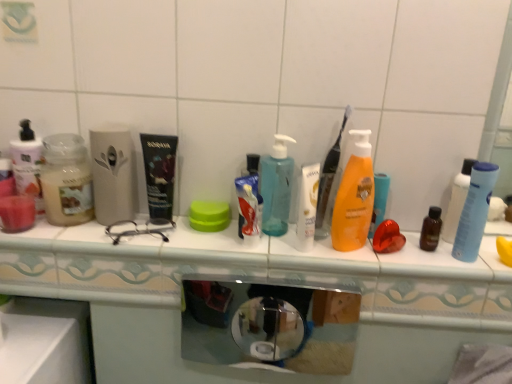
Question: From a real-world perspective, is translucent plastic pump bottle at center, which appears as the 2th bottle when viewed from the right, positioned under green plastic lid at center based on gravity?

Choices:
 (A) yes
 (B) no

Answer: (B)

Question: Are translucent plastic pump bottle at center, the 2th bottle viewed from the left, and green plastic lid at center beside each other?

Choices:
 (A) yes
 (B) no

Answer: (B)

Question: Does translucent plastic pump bottle at center, which appears as the 2th bottle when viewed from the right, have a lesser height compared to green plastic lid at center?

Choices:
 (A) no
 (B) yes

Answer: (A)

Question: Is translucent plastic pump bottle at center, the 2th bottle viewed from the left, turned away from green plastic lid at center?

Choices:
 (A) yes
 (B) no

Answer: (B)

Question: Are translucent plastic pump bottle at center, which appears as the 2th bottle when viewed from the right, and green plastic lid at center located far from each other?

Choices:
 (A) no
 (B) yes

Answer: (A)

Question: Considering the positions of white glossy toothpaste at center and orange matte lotion at center, marked as the third bottle in a left-to-right arrangement, in the image, is white glossy toothpaste at center bigger or smaller than orange matte lotion at center, marked as the third bottle in a left-to-right arrangement,?

Choices:
 (A) big
 (B) small

Answer: (B)

Question: From their relative heights in the image, would you say white glossy toothpaste at center is taller or shorter than orange matte lotion at center, the 1th bottle when ordered from right to left?

Choices:
 (A) short
 (B) tall

Answer: (A)

Question: Is white glossy toothpaste at center inside or outside of orange matte lotion at center, marked as the third bottle in a left-to-right arrangement?

Choices:
 (A) outside
 (B) inside

Answer: (A)

Question: Would you say white glossy toothpaste at center is to the left or to the right of orange matte lotion at center, the 1th bottle when ordered from right to left, in the picture?

Choices:
 (A) left
 (B) right

Answer: (A)

Question: Looking at their shapes, would you say orange matte lotion at center, marked as the third bottle in a left-to-right arrangement, is wider or thinner than dark blue plastic tube at center?

Choices:
 (A) thin
 (B) wide

Answer: (A)

Question: Does point (356, 130) appear closer or farther from the camera than point (154, 148)?

Choices:
 (A) closer
 (B) farther

Answer: (B)

Question: Considering the positions of orange matte lotion at center, the 1th bottle when ordered from right to left, and dark blue plastic tube at center in the image, is orange matte lotion at center, the 1th bottle when ordered from right to left, taller or shorter than dark blue plastic tube at center?

Choices:
 (A) tall
 (B) short

Answer: (A)

Question: From a real-world perspective, relative to dark blue plastic tube at center, is orange matte lotion at center, the 1th bottle when ordered from right to left, vertically above or below?

Choices:
 (A) above
 (B) below

Answer: (A)

Question: Is white glossy toothpaste at center to the left or to the right of translucent plastic pump bottle at center, which appears as the 2th bottle when viewed from the right, in the image?

Choices:
 (A) right
 (B) left

Answer: (B)

Question: Considering the positions of point (252, 198) and point (270, 150), is point (252, 198) closer or farther from the camera than point (270, 150)?

Choices:
 (A) closer
 (B) farther

Answer: (A)